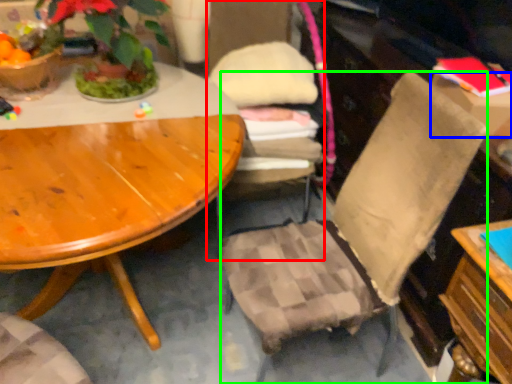
Question: Considering the real-world distances, which object is farthest from chair (highlighted by a red box)? box (highlighted by a blue box) or chair (highlighted by a green box)?

Choices:
 (A) box
 (B) chair

Answer: (A)